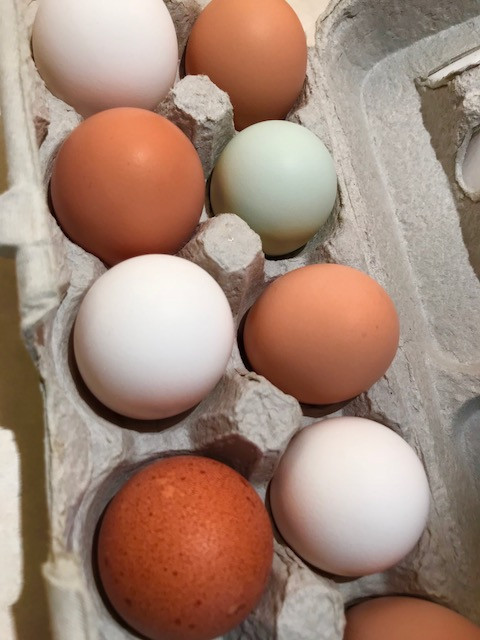
The image size is (480, 640). I want to click on shadow in top of container inside, so click(438, 112).